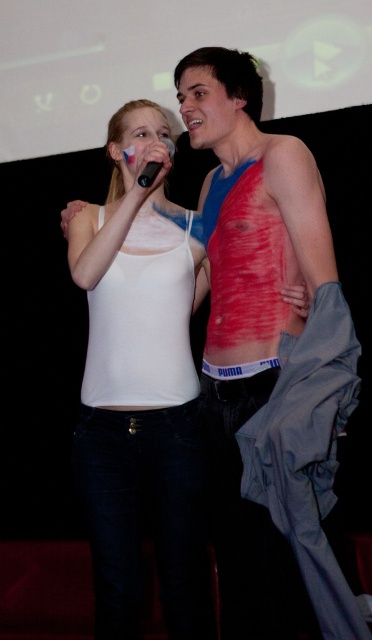
Question: In this image, where is white matte tank top at center located relative to black matte microphone at upper center?

Choices:
 (A) above
 (B) below

Answer: (B)

Question: Does white matte tank top at center have a smaller size compared to black matte microphone at upper center?

Choices:
 (A) no
 (B) yes

Answer: (A)

Question: Which of the following is the closest to the observer?

Choices:
 (A) black matte microphone at upper center
 (B) white matte tank top at center

Answer: (B)

Question: Can you confirm if white matte tank top at center is positioned to the left of black matte microphone at upper center?

Choices:
 (A) no
 (B) yes

Answer: (B)